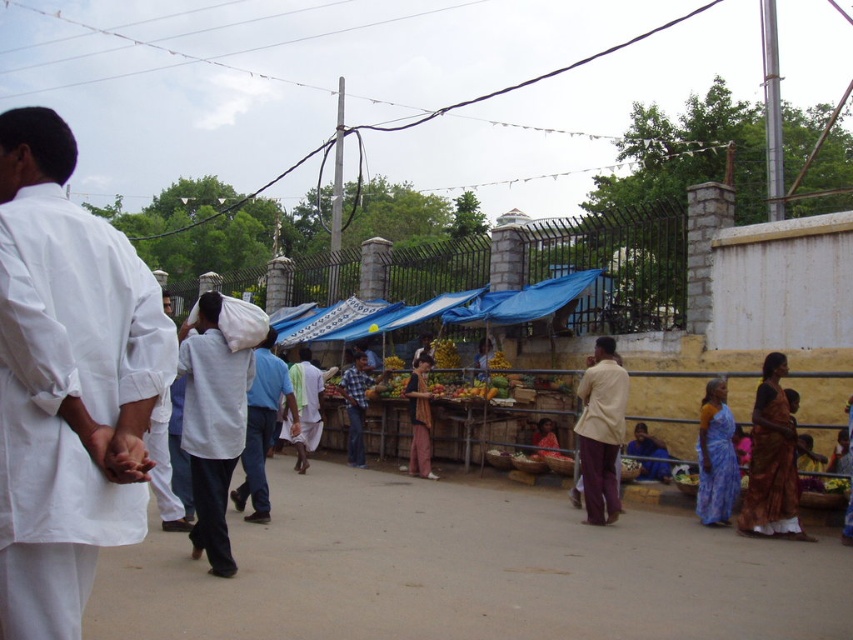
Which is behind, point (627, 384) or point (306, 456)?

Positioned behind is point (306, 456).

Describe the element at coordinates (601, 432) in the screenshot. This screenshot has width=853, height=640. I see `light beige fabric at center` at that location.

Find the location of a particular element. The image size is (853, 640). light beige fabric at center is located at coordinates (601, 432).

Who is more distant from viewer, [105,321] or [357,433]?

Positioned behind is point [357,433].

Which is in front, point (44, 612) or point (357, 429)?

Point (44, 612) is in front.

Is point (158, 310) closer to viewer compared to point (346, 412)?

Yes, it is.

Where is `white cotton shirt at left`? white cotton shirt at left is located at coordinates (67, 381).

Is light beige fabric at center below matte pink dress at center?

No, light beige fabric at center is not below matte pink dress at center.

Between point (611, 472) and point (405, 390), which one is positioned in front?

Point (611, 472) is in front.

This screenshot has height=640, width=853. Identify the location of light beige fabric at center. (601, 432).